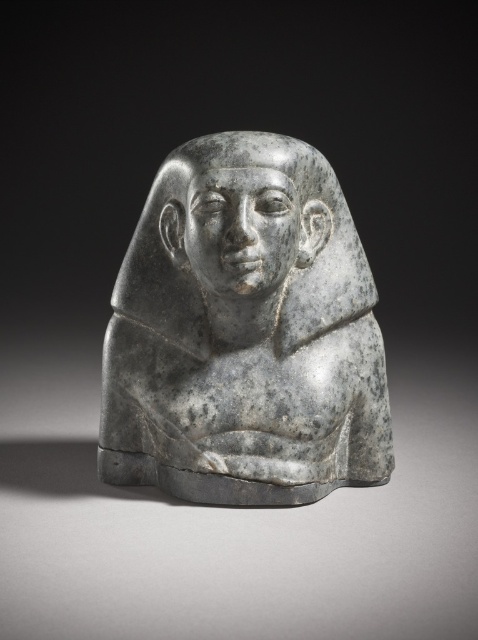
Does point (158, 273) lie in front of point (236, 157)?

No, it is behind (236, 157).

Can you confirm if gray stone bust at center is shorter than gray stone head at center?

No, gray stone bust at center is not shorter than gray stone head at center.

Describe the element at coordinates (245, 333) in the screenshot. I see `gray stone bust at center` at that location.

Locate an element on the screen. The width and height of the screenshot is (478, 640). gray stone bust at center is located at coordinates (245, 333).